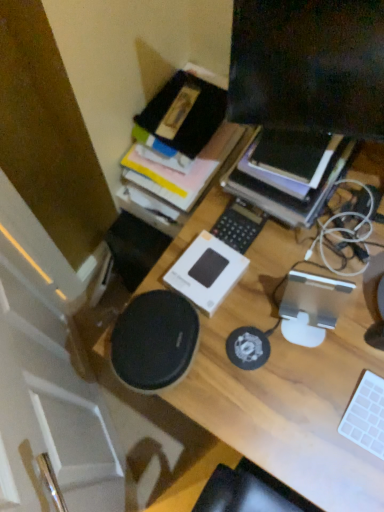
Locate an element on the screen. This screenshot has width=384, height=512. free space to the back side of white matte keyboard at lower right, the first laptop keyboard from the right is located at coordinates (350, 341).